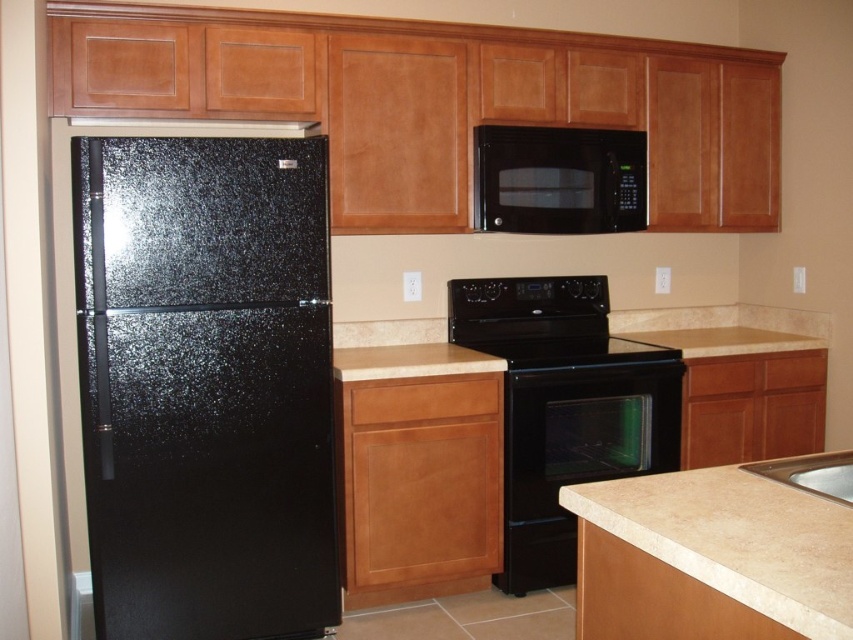
Can you confirm if black speckled refrigerator at left is positioned below black glossy exhaust hood at upper center?

Answer: Correct, black speckled refrigerator at left is located below black glossy exhaust hood at upper center.

Is point (213, 547) farther from camera compared to point (74, 122)?

No, it is in front of (74, 122).

Image resolution: width=853 pixels, height=640 pixels. What are the coordinates of `black speckled refrigerator at left` in the screenshot? It's located at (206, 385).

Is black speckled refrigerator at left bigger than black glass stove at center?

Yes.

Is point (293, 234) farther from camera compared to point (492, 346)?

No, it is not.

Is point (286, 176) less distant than point (541, 340)?

Yes, point (286, 176) is in front of point (541, 340).

I want to click on black speckled refrigerator at left, so click(206, 385).

Is black glass stove at center to the left of white marble sink at lower right from the viewer's perspective?

Yes, black glass stove at center is to the left of white marble sink at lower right.

Is black glass stove at center above white marble sink at lower right?

Correct, black glass stove at center is located above white marble sink at lower right.

I want to click on black glass stove at center, so click(x=570, y=349).

Identify the location of black glass stove at center. The image size is (853, 640). (570, 349).